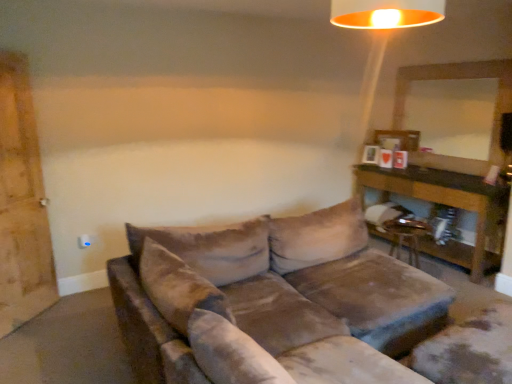
Question: Could you tell me if brown wooden table at right is facing velvet brown couch at center?

Choices:
 (A) yes
 (B) no

Answer: (A)

Question: Is brown wooden table at right outside of velvet brown couch at center?

Choices:
 (A) yes
 (B) no

Answer: (A)

Question: Is brown wooden table at right at the right side of velvet brown couch at center?

Choices:
 (A) no
 (B) yes

Answer: (B)

Question: Is brown wooden table at right behind velvet brown couch at center?

Choices:
 (A) no
 (B) yes

Answer: (B)

Question: From the image's perspective, does brown wooden table at right appear higher than velvet brown couch at center?

Choices:
 (A) no
 (B) yes

Answer: (B)

Question: Is velvet brown couch at center surrounded by brown wooden table at right?

Choices:
 (A) no
 (B) yes

Answer: (A)

Question: From a real-world perspective, does velvet brown couch at center sit lower than metallic gold lampshade at upper center?

Choices:
 (A) no
 (B) yes

Answer: (B)

Question: Considering the relative sizes of velvet brown couch at center and metallic gold lampshade at upper center in the image provided, is velvet brown couch at center wider than metallic gold lampshade at upper center?

Choices:
 (A) no
 (B) yes

Answer: (B)

Question: Could you tell me if velvet brown couch at center is turned towards metallic gold lampshade at upper center?

Choices:
 (A) yes
 (B) no

Answer: (B)

Question: Considering the relative positions of velvet brown couch at center and metallic gold lampshade at upper center in the image provided, is velvet brown couch at center to the right of metallic gold lampshade at upper center from the viewer's perspective?

Choices:
 (A) no
 (B) yes

Answer: (A)

Question: Is velvet brown couch at center facing away from metallic gold lampshade at upper center?

Choices:
 (A) yes
 (B) no

Answer: (B)

Question: Are velvet brown couch at center and metallic gold lampshade at upper center beside each other?

Choices:
 (A) yes
 (B) no

Answer: (B)

Question: Is metallic gold swivel chair at lower right further to camera compared to brown wooden table at right?

Choices:
 (A) no
 (B) yes

Answer: (A)